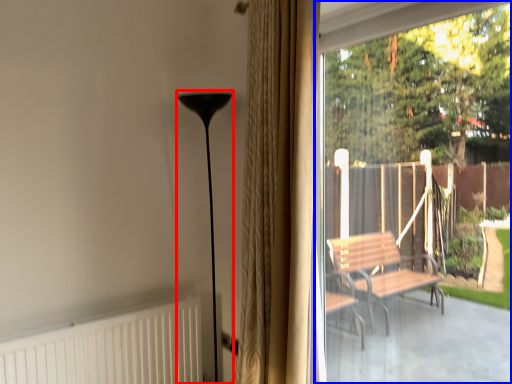
Question: Which point is further to the camera, lamp (highlighted by a red box) or window screen (highlighted by a blue box)?

Choices:
 (A) lamp
 (B) window screen

Answer: (A)